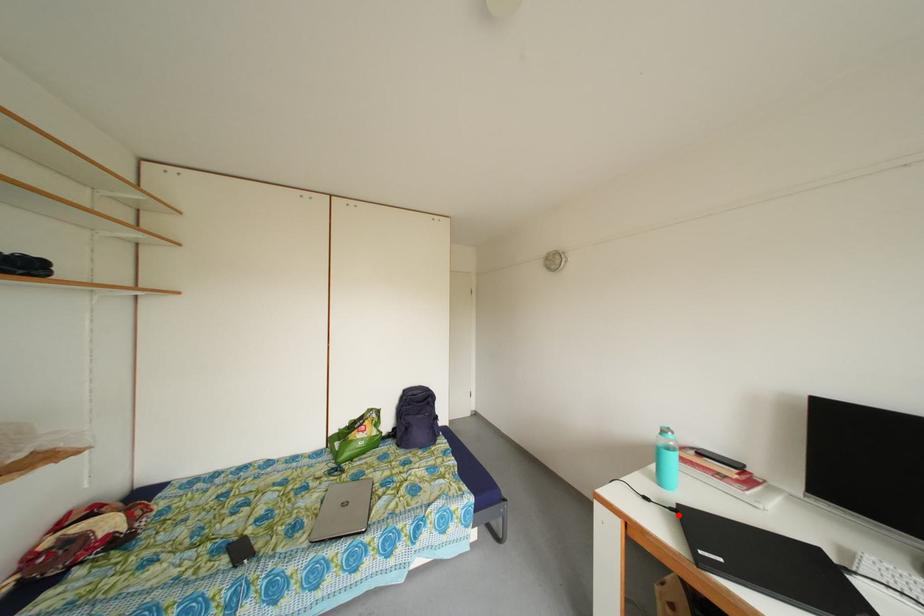
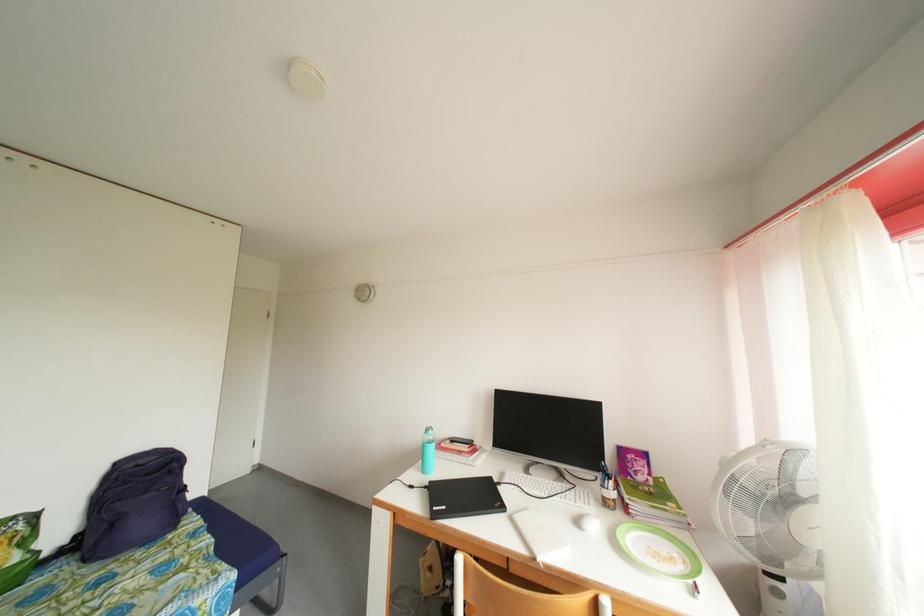
Where in the second image is the point corresponding to the highlighted location from the first image?

(432, 493)